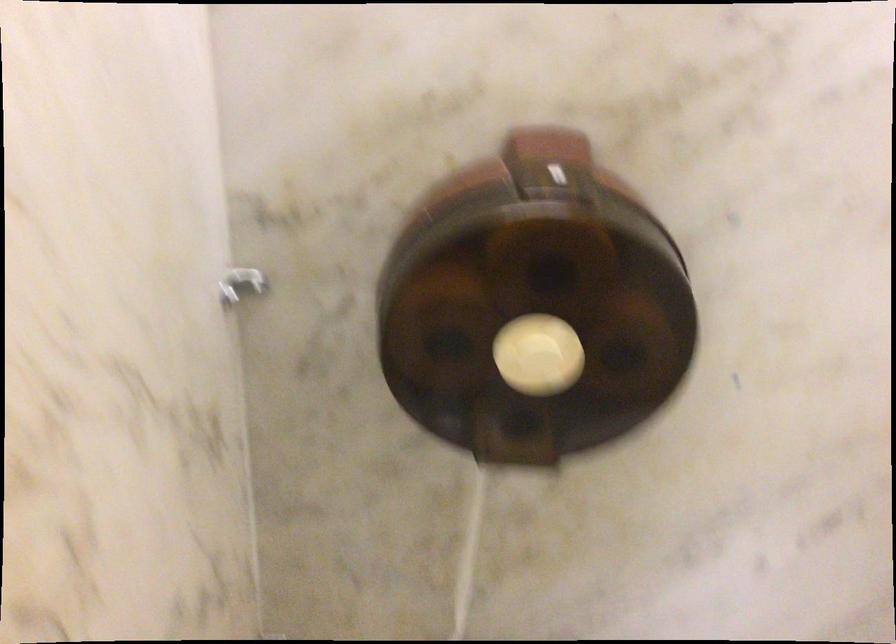
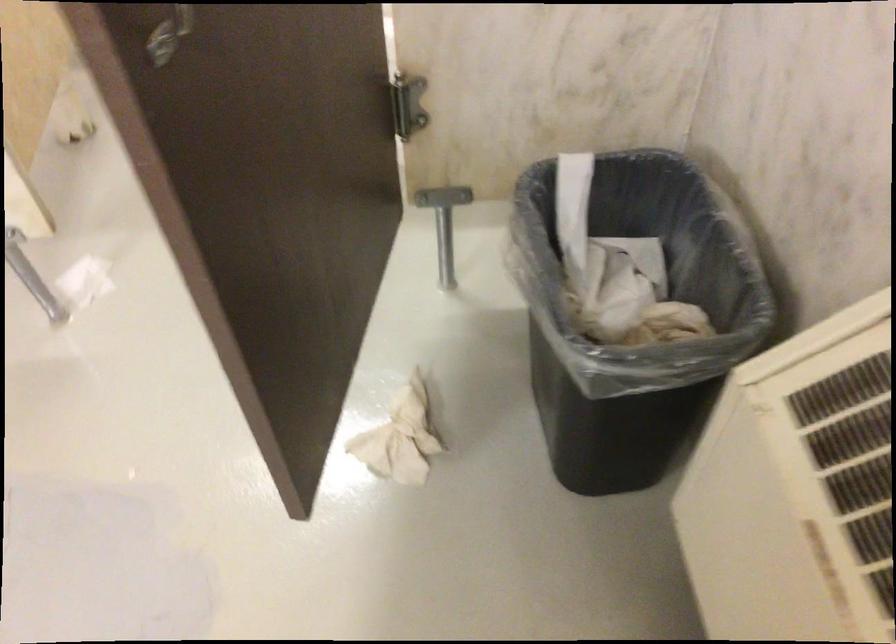
In a continuous first-person perspective shot, in which direction is the camera moving?

The cameraman walked toward right, backward.